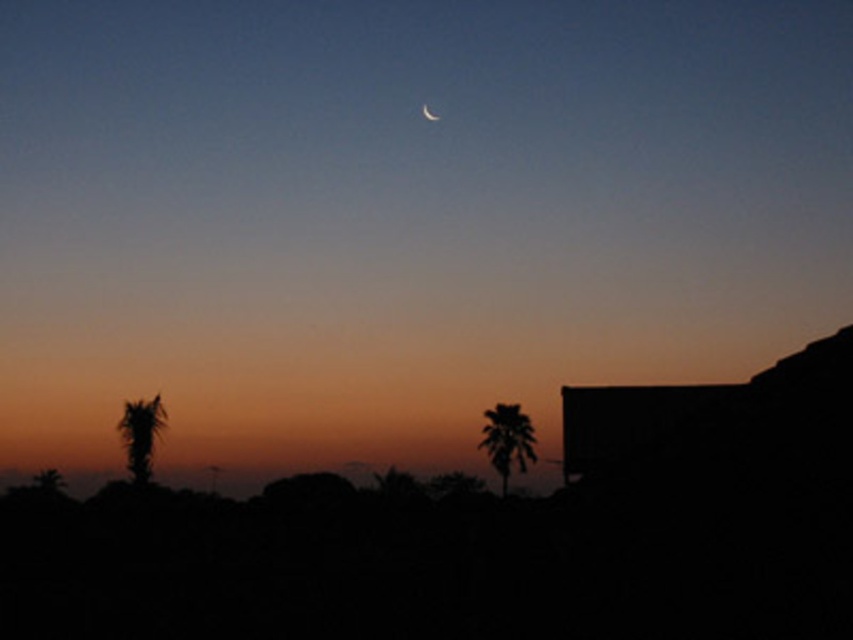
Looking at this image, which is above, silhouette leafy palm at center or matte silver crescent at upper center?

matte silver crescent at upper center is above.

Locate an element on the screen. silhouette leafy palm at center is located at coordinates (508, 440).

Is silhouette palm tree at lower left below matte silver crescent at upper center?

Indeed, silhouette palm tree at lower left is positioned under matte silver crescent at upper center.

Which is behind, point (143, 464) or point (421, 115)?

The point (421, 115) is more distant.

Is point (148, 451) positioned before point (424, 115)?

Yes, it is in front of point (424, 115).

Locate an element on the screen. Image resolution: width=853 pixels, height=640 pixels. silhouette palm tree at lower left is located at coordinates (140, 435).

Is silhouette leafy palm at center further to the viewer compared to silhouette palm tree at lower left?

No.

Which is behind, point (524, 452) or point (119, 420)?

The point (524, 452) is more distant.

I want to click on silhouette leafy palm at center, so [x=508, y=440].